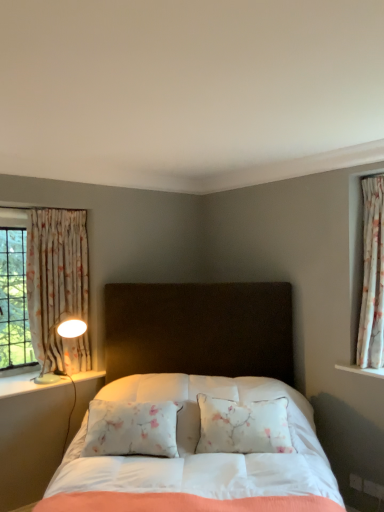
Question: Is point (62, 250) closer or farther from the camera than point (180, 401)?

Choices:
 (A) farther
 (B) closer

Answer: (A)

Question: Is floral fabric curtain at left, acting as the first curtain starting from the back, to the left or to the right of white fabric bed at center in the image?

Choices:
 (A) right
 (B) left

Answer: (B)

Question: Estimate the real-world distances between objects in this image. Which object is closer to the white fabric bed at center?

Choices:
 (A) white glossy lamp at left
 (B) floral fabric curtain at right, the 1th curtain from the front
 (C) floral fabric curtain at left, acting as the first curtain starting from the back

Answer: (A)

Question: Which object is positioned farthest from the floral fabric curtain at right, the 1th curtain from the front?

Choices:
 (A) white glossy lamp at left
 (B) floral fabric curtain at left, arranged as the 2th curtain when viewed from the front
 (C) white fabric bed at center

Answer: (B)